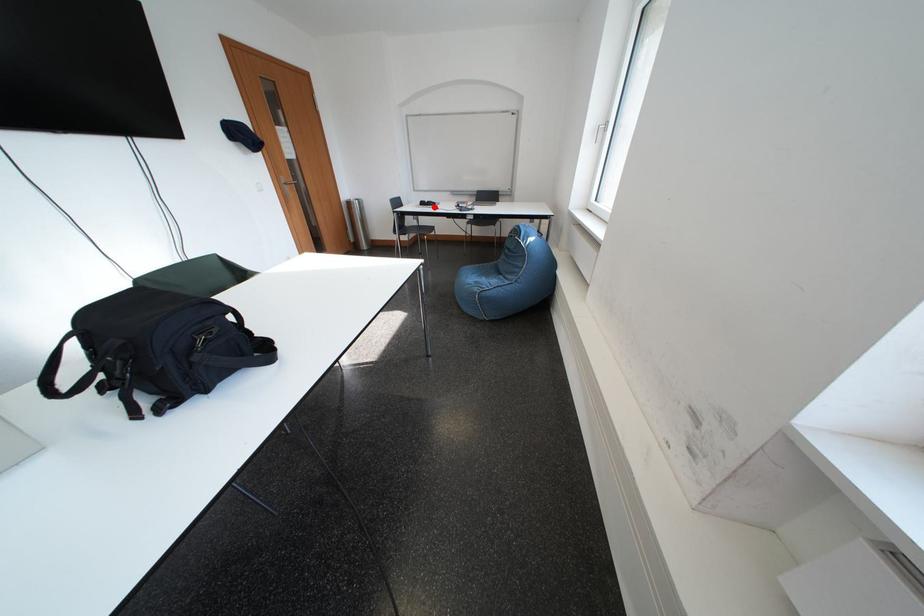
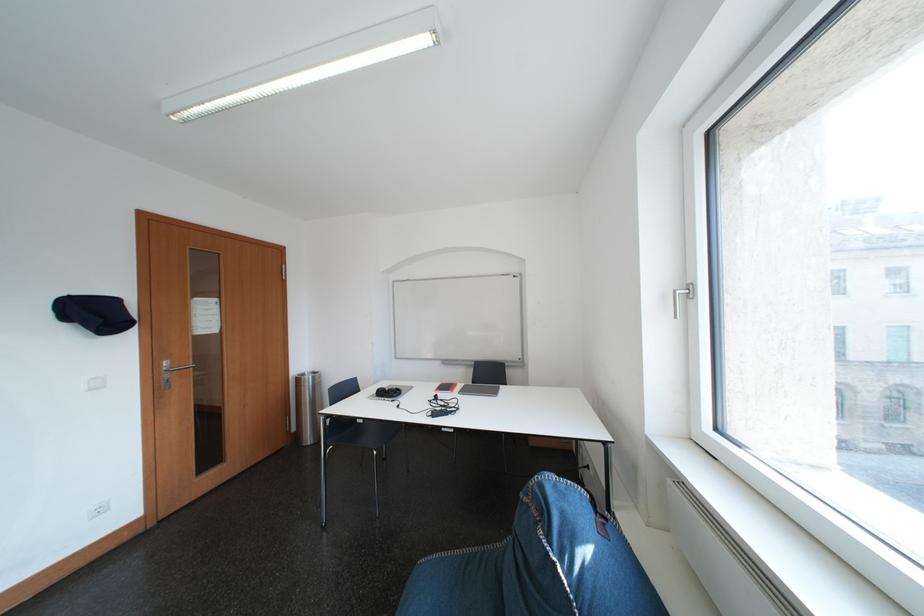
Question: I am providing you with two images of the same scene from different viewpoints. Given a red point in image1, look at the same physical point in image2. Is it:

Choices:
 (A) Closer to the viewpoint
 (B) Farther from the viewpoint

Answer: (B)